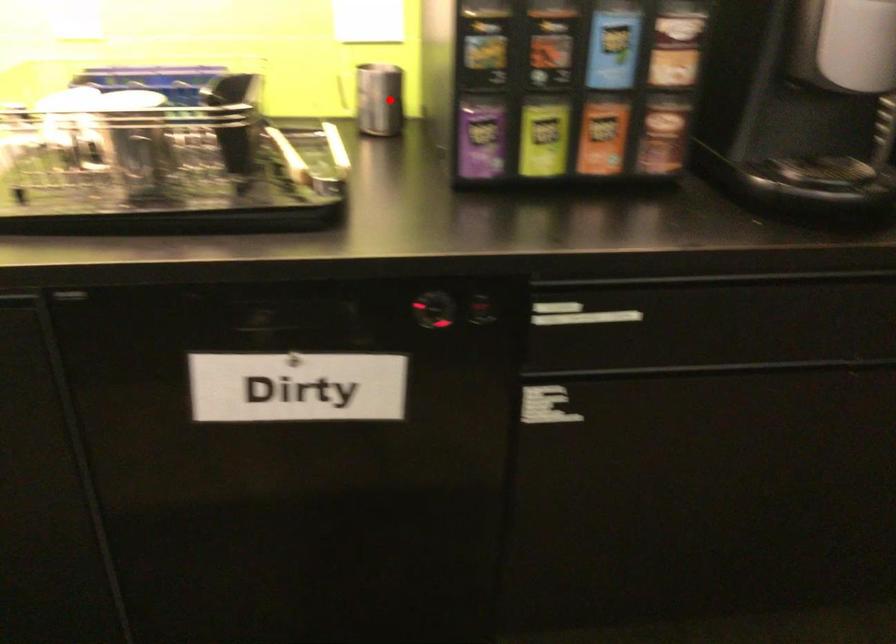
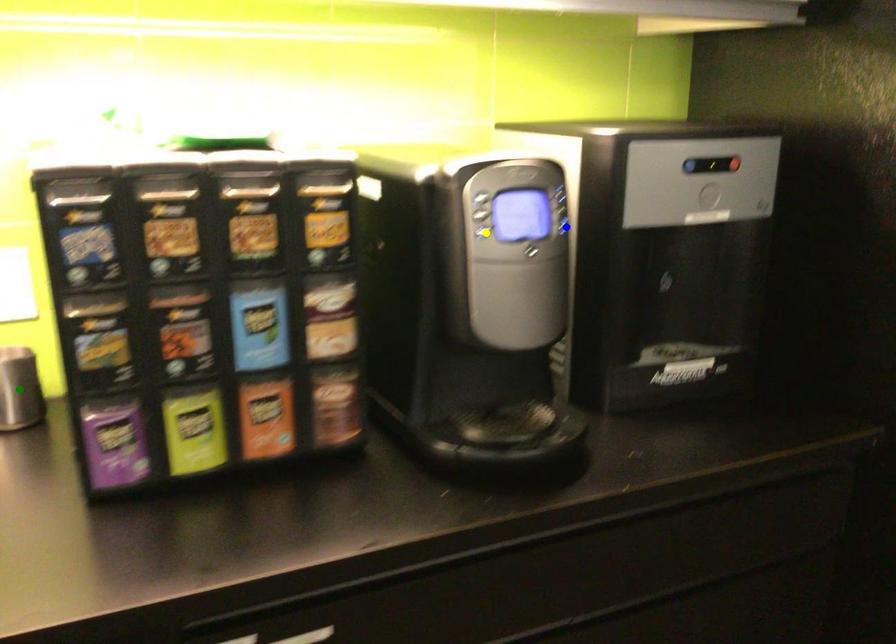
Question: I am providing you with two images of the same scene from different viewpoints. A red point is marked on the first image. You are given multiple points on the second image. Which mark in image 2 goes with the point in image 1?

Choices:
 (A) blue point
 (B) green point
 (C) yellow point

Answer: (B)